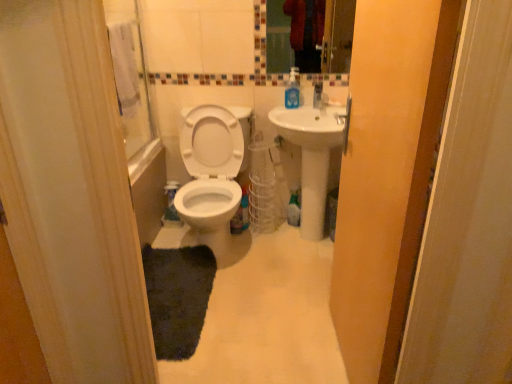
Image resolution: width=512 pixels, height=384 pixels. I want to click on vacant area that is in front of white glossy toilet at center, so click(255, 304).